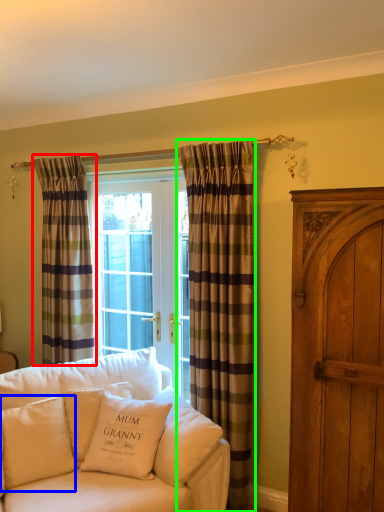
Question: Which is farther away from curtain (highlighted by a red box)? pillow (highlighted by a blue box) or curtain (highlighted by a green box)?

Choices:
 (A) pillow
 (B) curtain

Answer: (B)